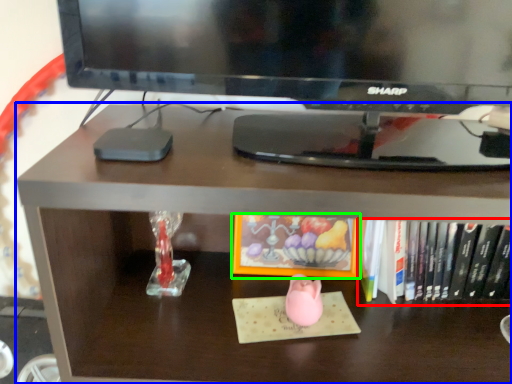
Question: Which object is positioned closest to book (highlighted by a red box)? Select from desk (highlighted by a blue box) and book (highlighted by a green box).

Choices:
 (A) desk
 (B) book

Answer: (B)